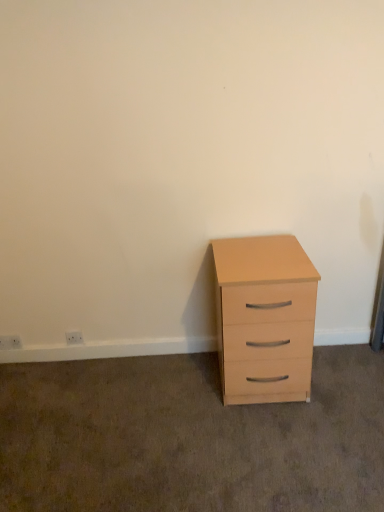
Locate an element on the screen. free point above light wood chest of drawers at right (from a real-world perspective) is located at coordinates (261, 253).